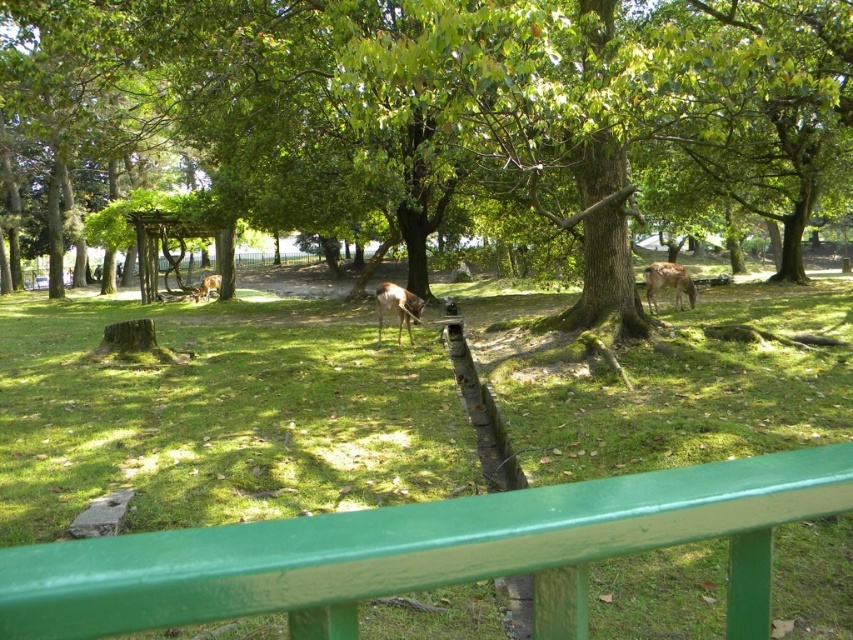
You are standing in the park and want to take a photo that includes both the green wooden railing and the deer in the midground. Which point, point (x=650, y=273) or point (x=212, y=280), is closer to you?

Point (x=650, y=273) is closer to you than point (x=212, y=280).